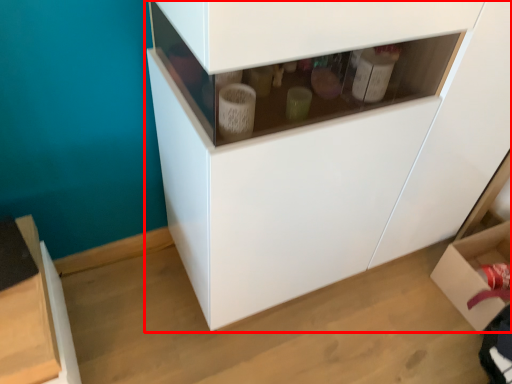
Question: From the image's perspective, where is cabinetry (annotated by the red box) located relative to cardboard box?

Choices:
 (A) above
 (B) below

Answer: (A)